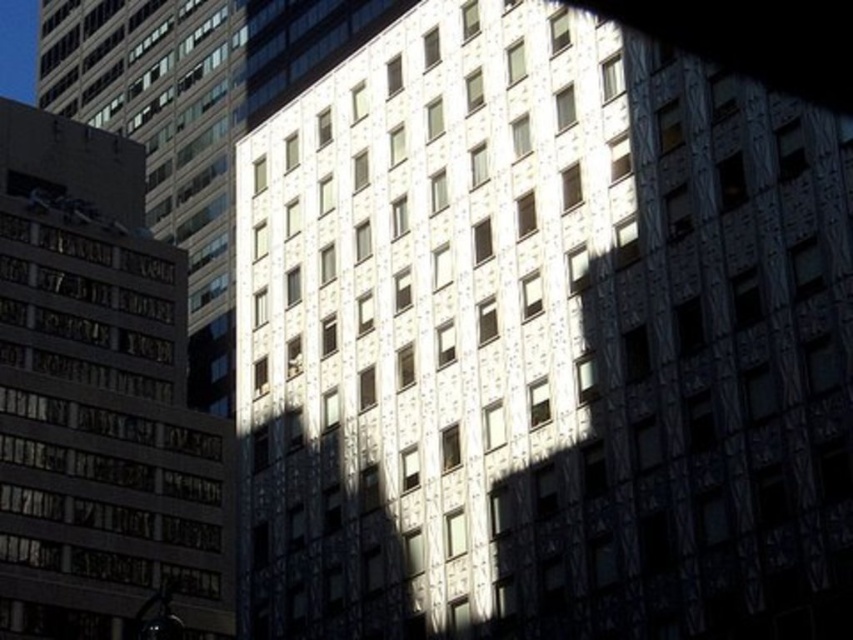
Question: Does white textured building at center appear over brick textured building at left?

Choices:
 (A) no
 (B) yes

Answer: (B)

Question: Observing the image, what is the correct spatial positioning of white textured building at center in reference to brick textured building at left?

Choices:
 (A) below
 (B) above

Answer: (B)

Question: Which of the following is the farthest from the observer?

Choices:
 (A) brick textured building at left
 (B) white textured building at center

Answer: (A)

Question: Which point appears closest to the camera in this image?

Choices:
 (A) (51, 384)
 (B) (699, 422)

Answer: (B)

Question: Does white textured building at center appear on the right side of brick textured building at left?

Choices:
 (A) no
 (B) yes

Answer: (B)